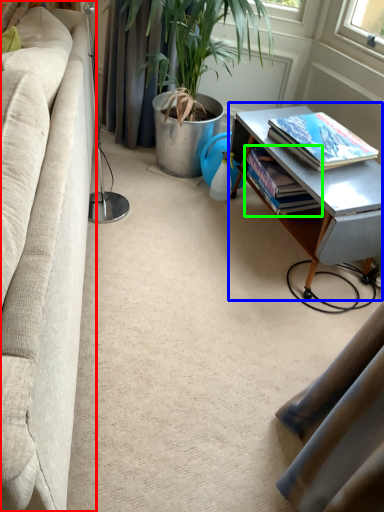
Question: Considering the real-world distances, which object is farthest from studio couch (highlighted by a red box)? table (highlighted by a blue box) or book (highlighted by a green box)?

Choices:
 (A) table
 (B) book

Answer: (B)